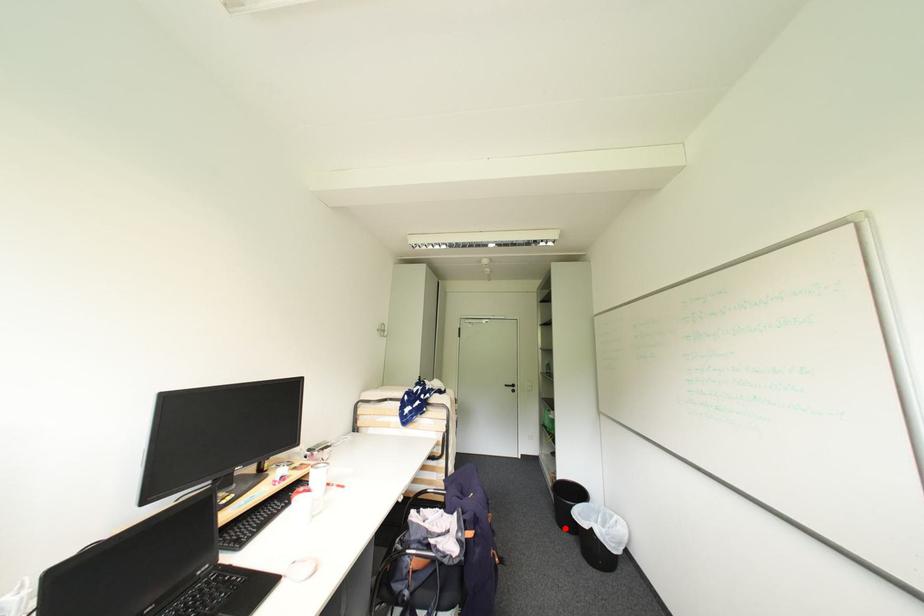
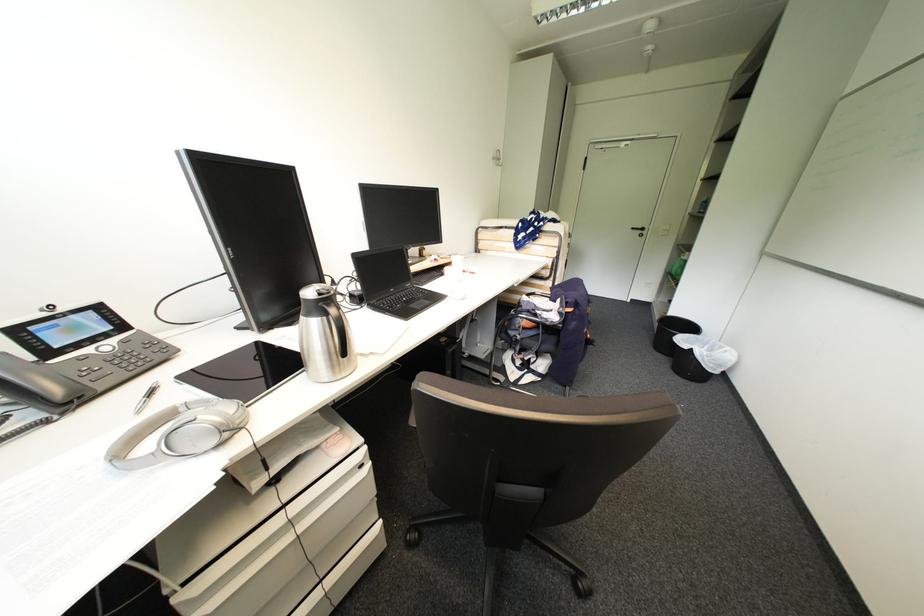
Find the pixel in the second image that matches the highlighted location in the first image.

(660, 351)